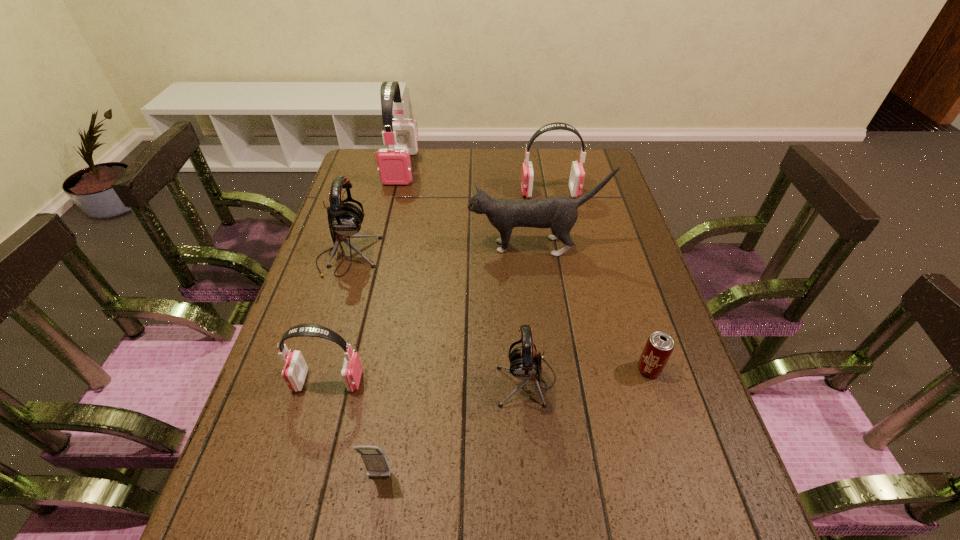
In order to click on vacant space that satisfies the following two spatial constraints: 1. on the outer surface of the second smallest pink earphone; 2. on the front-facing side of the fifth object from right to left in this screenshot , I will do `click(606, 477)`.